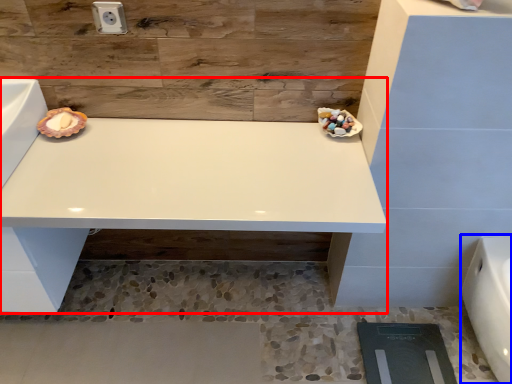
Question: Which object appears closest to the camera in this image, vanity (highlighted by a red box) or porcelain (highlighted by a blue box)?

Choices:
 (A) vanity
 (B) porcelain

Answer: (A)